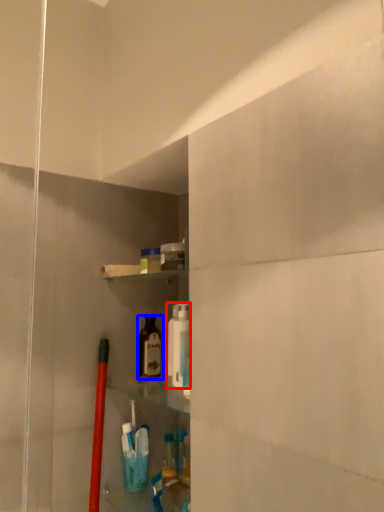
Question: Which object is further to the camera taking this photo, cleaning product (highlighted by a red box) or bottle (highlighted by a blue box)?

Choices:
 (A) cleaning product
 (B) bottle

Answer: (B)